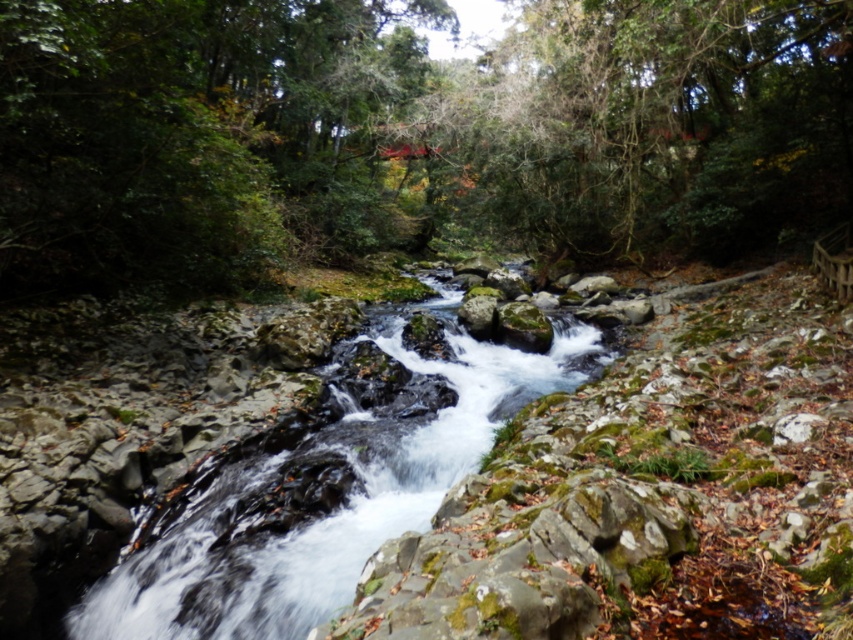
Question: Which of these objects is positioned closest to the smooth rock stream at center?

Choices:
 (A) white smooth rock at center-right
 (B) green leafy tree at center

Answer: (A)

Question: Does green leafy tree at center appear under white smooth rock at center-right?

Choices:
 (A) yes
 (B) no

Answer: (B)

Question: Among these objects, which one is nearest to the camera?

Choices:
 (A) green leafy tree at center
 (B) white smooth rock at center-right
 (C) smooth rock stream at center

Answer: (C)

Question: Can you confirm if smooth rock stream at center is positioned below white smooth rock at center-right?

Choices:
 (A) no
 (B) yes

Answer: (B)

Question: Does green leafy tree at center come in front of white smooth rock at center-right?

Choices:
 (A) yes
 (B) no

Answer: (A)

Question: Which point is closer to the camera?

Choices:
 (A) white smooth rock at center-right
 (B) green leafy tree at center
 (C) smooth rock stream at center

Answer: (C)